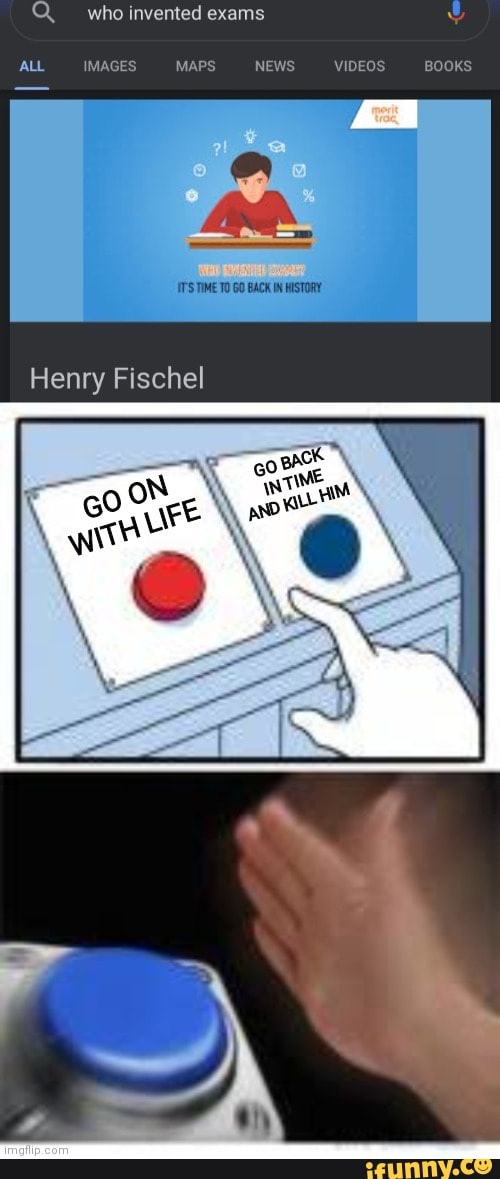
At what (x,y) coordinates should I click in order to perform the action: click on wooden desk. Please return your answer as a coordinate pair (x, y). This screenshot has height=1179, width=500. Looking at the image, I should click on (274, 238).